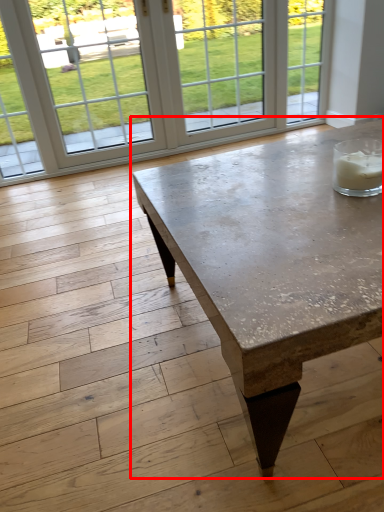
Question: From the image's perspective, where is coffee table (annotated by the red box) located in relation to window in the image?

Choices:
 (A) above
 (B) below

Answer: (B)